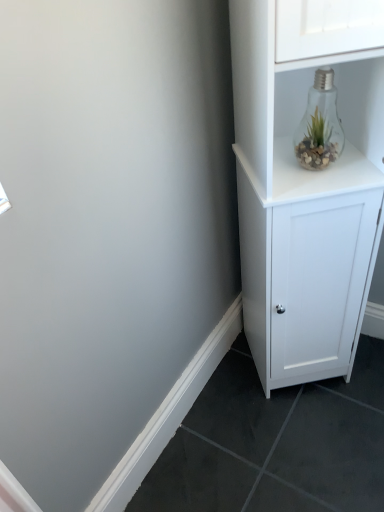
Question: Is white matte cabinet at upper right placed right next to clear glass light bulb at upper right?

Choices:
 (A) no
 (B) yes

Answer: (A)

Question: Is white matte cabinet at upper right further to camera compared to clear glass light bulb at upper right?

Choices:
 (A) yes
 (B) no

Answer: (B)

Question: Are white matte cabinet at upper right and clear glass light bulb at upper right located far from each other?

Choices:
 (A) no
 (B) yes

Answer: (A)

Question: Is white matte cabinet at upper right positioned with its back to clear glass light bulb at upper right?

Choices:
 (A) yes
 (B) no

Answer: (A)

Question: Is the depth of white matte cabinet at upper right less than that of clear glass light bulb at upper right?

Choices:
 (A) no
 (B) yes

Answer: (B)

Question: Is white matte cabinet at upper right at the left side of clear glass light bulb at upper right?

Choices:
 (A) no
 (B) yes

Answer: (A)

Question: Is clear glass light bulb at upper right turned away from white matte cabinet at upper right?

Choices:
 (A) yes
 (B) no

Answer: (A)

Question: Is clear glass light bulb at upper right at the left side of white matte cabinet at upper right?

Choices:
 (A) yes
 (B) no

Answer: (A)

Question: Is clear glass light bulb at upper right next to white matte cabinet at upper right and touching it?

Choices:
 (A) no
 (B) yes

Answer: (A)

Question: Can you confirm if clear glass light bulb at upper right is taller than white matte cabinet at upper right?

Choices:
 (A) yes
 (B) no

Answer: (B)

Question: Considering the relative sizes of clear glass light bulb at upper right and white matte cabinet at upper right in the image provided, is clear glass light bulb at upper right thinner than white matte cabinet at upper right?

Choices:
 (A) no
 (B) yes

Answer: (B)

Question: Is clear glass light bulb at upper right at the right side of white matte cabinet at upper right?

Choices:
 (A) no
 (B) yes

Answer: (A)

Question: Considering the positions of clear glass light bulb at upper right and white matte cabinet at upper right in the image, is clear glass light bulb at upper right taller or shorter than white matte cabinet at upper right?

Choices:
 (A) tall
 (B) short

Answer: (B)